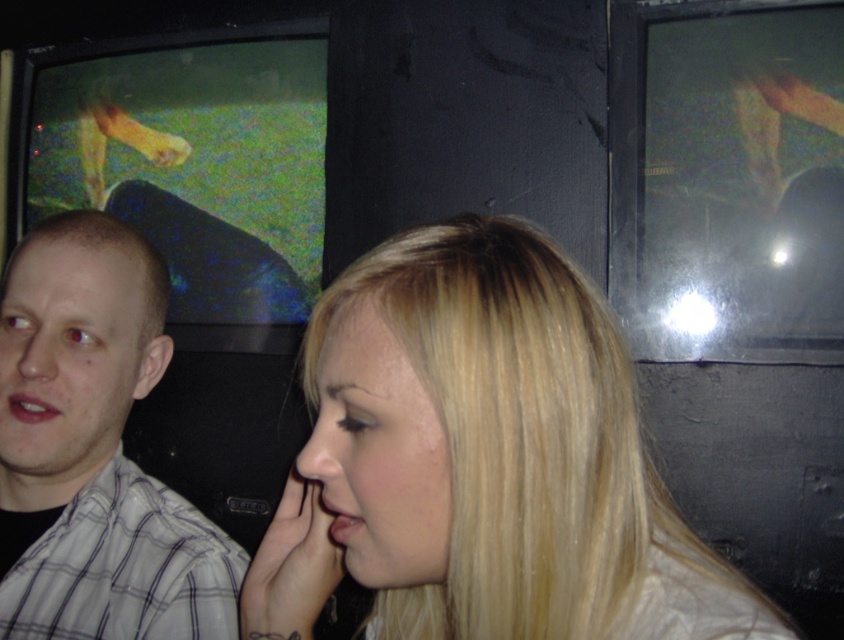
Question: Observing the image, what is the correct spatial positioning of blonde hair at center in reference to white checkered shirt at left?

Choices:
 (A) above
 (B) below

Answer: (B)

Question: Which point is closer to the camera?

Choices:
 (A) blonde hair at center
 (B) white checkered shirt at left

Answer: (A)

Question: Is blonde hair at center thinner than white checkered shirt at left?

Choices:
 (A) yes
 (B) no

Answer: (B)

Question: Can you confirm if blonde hair at center is positioned to the left of white checkered shirt at left?

Choices:
 (A) yes
 (B) no

Answer: (B)